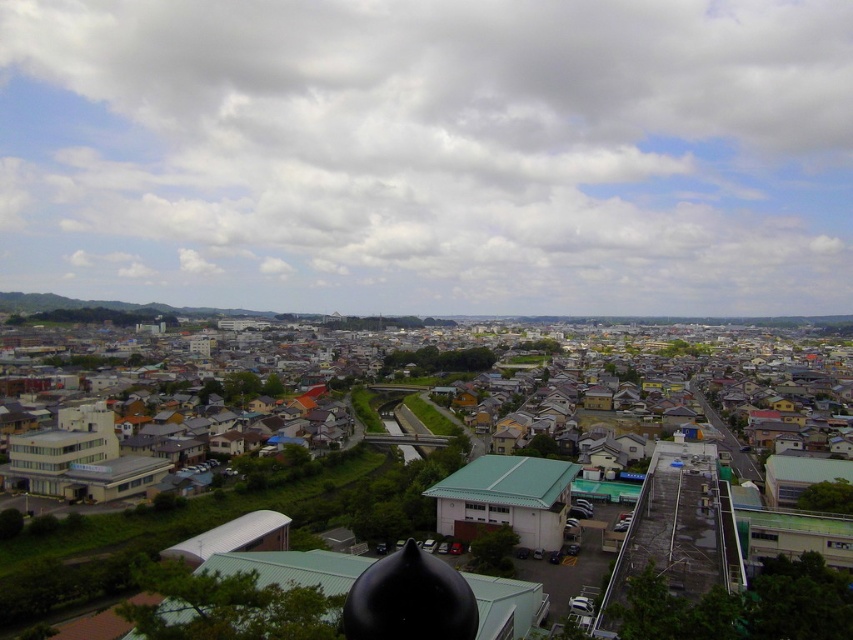
Question: From the image, what is the correct spatial relationship of white fluffy cloud at upper center in relation to matte gray building at center?

Choices:
 (A) right
 (B) left

Answer: (B)

Question: Which of the following is the farthest from the observer?

Choices:
 (A) white fluffy cloud at upper center
 (B) matte gray building at center

Answer: (A)

Question: Is white fluffy cloud at upper center wider than matte gray building at center?

Choices:
 (A) no
 (B) yes

Answer: (B)

Question: Can you confirm if white fluffy cloud at upper center is positioned to the left of matte gray building at center?

Choices:
 (A) yes
 (B) no

Answer: (A)

Question: Which point is closer to the camera taking this photo?

Choices:
 (A) (808, 464)
 (B) (535, 241)

Answer: (A)